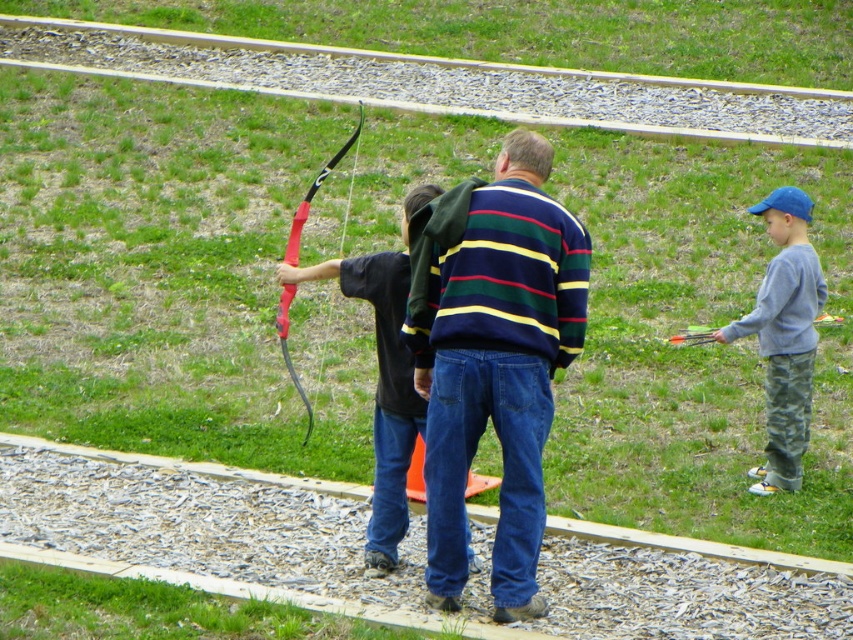
You are an archery instructor standing at the camera position. You need to retrieve the striped sweater at center to give it to the participant. Can you reach it without moving from your position?

The striped sweater at center is 8.09 meters away from the camera, so you cannot reach it without moving from your position.

You are an archery instructor standing at the starting point. You need to position a target stand between the striped sweater at center and the gravel path. According to the scene description, where should the target stand be placed?

The striped sweater at center is located at point (492,356), so the target stand should be placed between the striped sweater at center and the gravel path to ensure proper alignment for archery practice.

You are a photographer setting up a wide shot of the archery scene. You need to ensure both the striped sweater at center and the gray cotton sweatshirt at right are fully visible in the frame. Based on their positions and sizes, do you think the current camera angle can capture both without cropping either of them?

The striped sweater at center might be wider than gray cotton sweatshirt at right, so the camera angle should be adjusted to accommodate the wider width of the striped sweater at center to ensure both are fully visible.